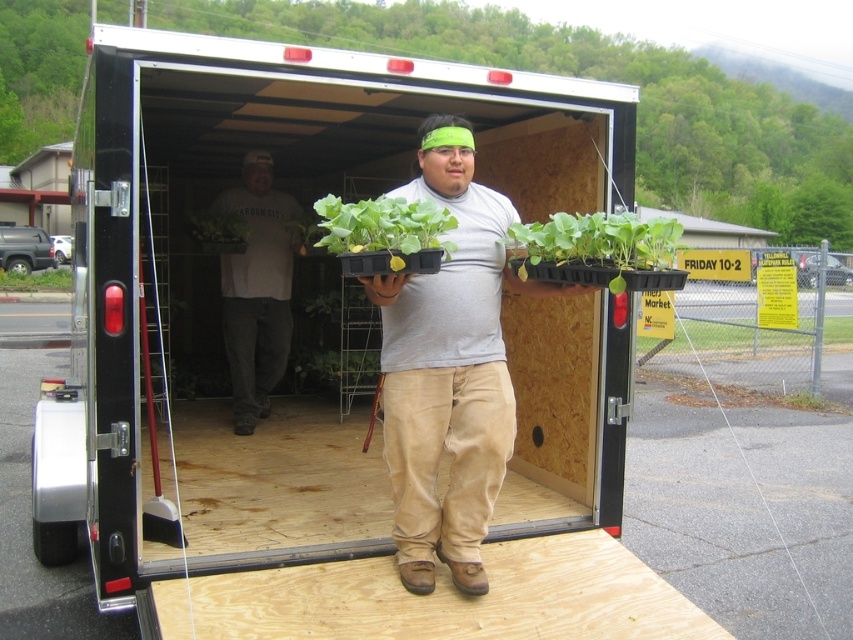
What is located at point (384, 234)?

A green matte tray at center is located at point (384, 234).

In the scene shown: You are a delivery person who needs to place a green leafy plant at lower right and a green leafy plant at center into a truck bed. Which plant should you place first if you want to maximize space efficiency?

The green leafy plant at lower right has a lesser width compared to the green leafy plant at center. To maximize space efficiency, you should place the wider green leafy plant at center first to utilize space effectively before placing the narrower green leafy plant at lower right.